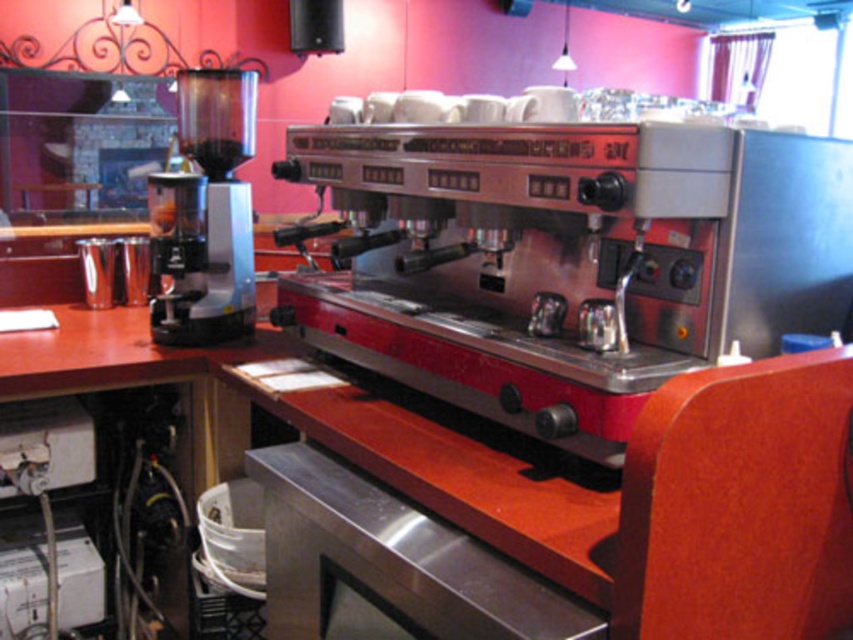
Does metallic espresso machine at center appear under matte black coffee grinder at left?

Correct, metallic espresso machine at center is located below matte black coffee grinder at left.

Is metallic espresso machine at center thinner than matte black coffee grinder at left?

Incorrect, metallic espresso machine at center's width is not less than matte black coffee grinder at left's.

Which is behind, point (520, 376) or point (183, 234)?

Point (183, 234)

Where is `metallic espresso machine at center`? metallic espresso machine at center is located at coordinates (569, 260).